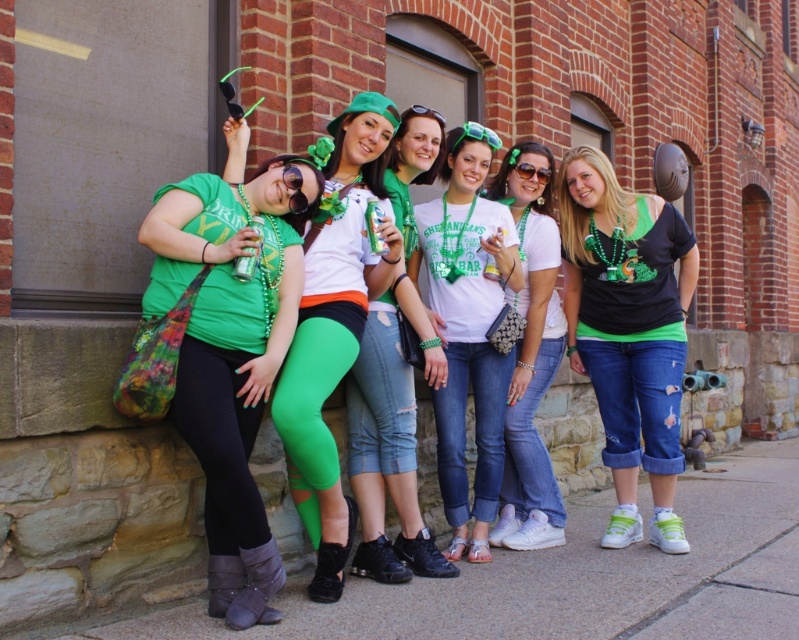
Question: Which object is farther from the camera taking this photo?

Choices:
 (A) green matte leggings at center
 (B) white matte t-shirt at center
 (C) matte green leggings at left
 (D) matte green t-shirt at center

Answer: (B)

Question: Which point appears closest to the camera in this image?

Choices:
 (A) (531, 516)
 (B) (485, 208)
 (C) (229, 456)
 (D) (635, 362)

Answer: (C)

Question: Is green matte leggings at center further to the viewer compared to matte green leggings at center?

Choices:
 (A) no
 (B) yes

Answer: (A)

Question: Which point is farther to the camera?

Choices:
 (A) (455, 456)
 (B) (352, 285)

Answer: (A)

Question: Is green matte leggings at center positioned in front of matte green leggings at center?

Choices:
 (A) yes
 (B) no

Answer: (A)

Question: Does matte green leggings at left have a smaller size compared to matte black t-shirt with green accents at center?

Choices:
 (A) yes
 (B) no

Answer: (A)